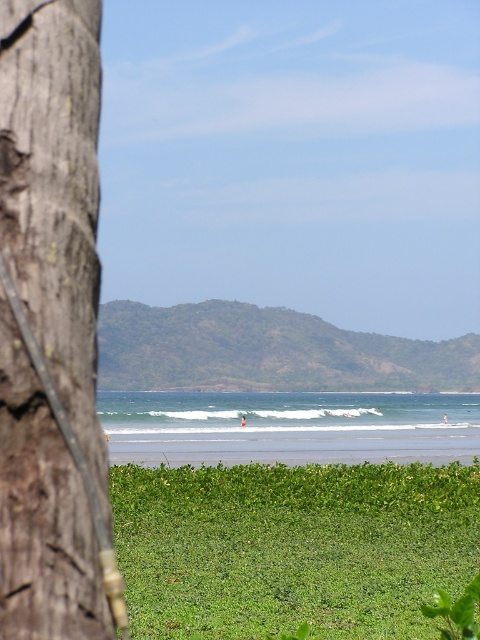
Question: From the image, what is the correct spatial relationship of green leafy grass at lower center in relation to green leafy tree at center?

Choices:
 (A) right
 (B) left

Answer: (B)

Question: Which point is closer to the camera?

Choices:
 (A) (106, 460)
 (B) (428, 346)
 (C) (219, 548)

Answer: (A)

Question: Which point is farther to the camera?

Choices:
 (A) (113, 490)
 (B) (354, 371)
 (C) (93, 561)

Answer: (B)

Question: Does brown rough tree trunk at left have a greater width compared to green leafy grass at lower center?

Choices:
 (A) no
 (B) yes

Answer: (A)

Question: In this image, where is brown rough tree trunk at left located relative to green leafy tree at center?

Choices:
 (A) left
 (B) right

Answer: (A)

Question: Which of these objects is positioned farthest from the green leafy tree at center?

Choices:
 (A) green leafy grass at lower center
 (B) brown rough tree trunk at left

Answer: (B)